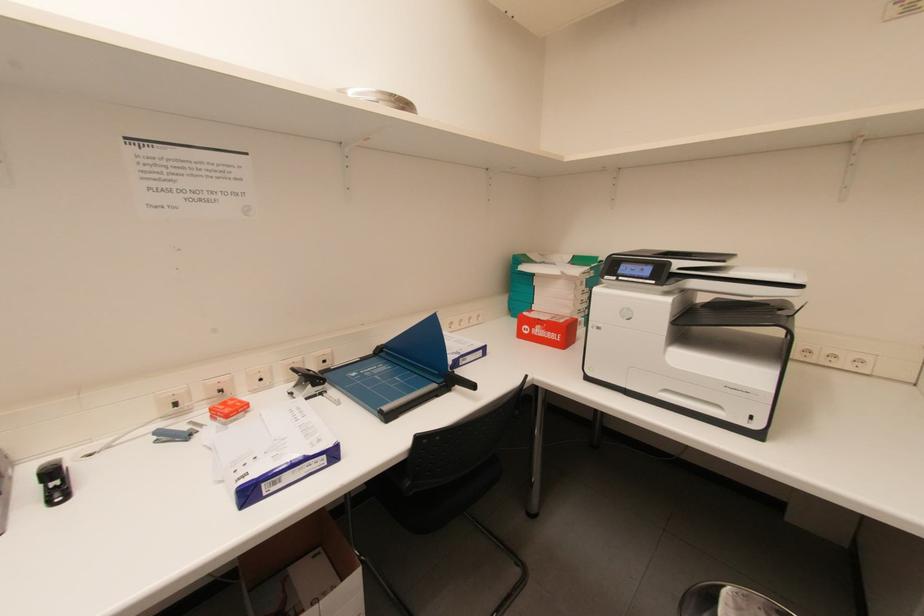
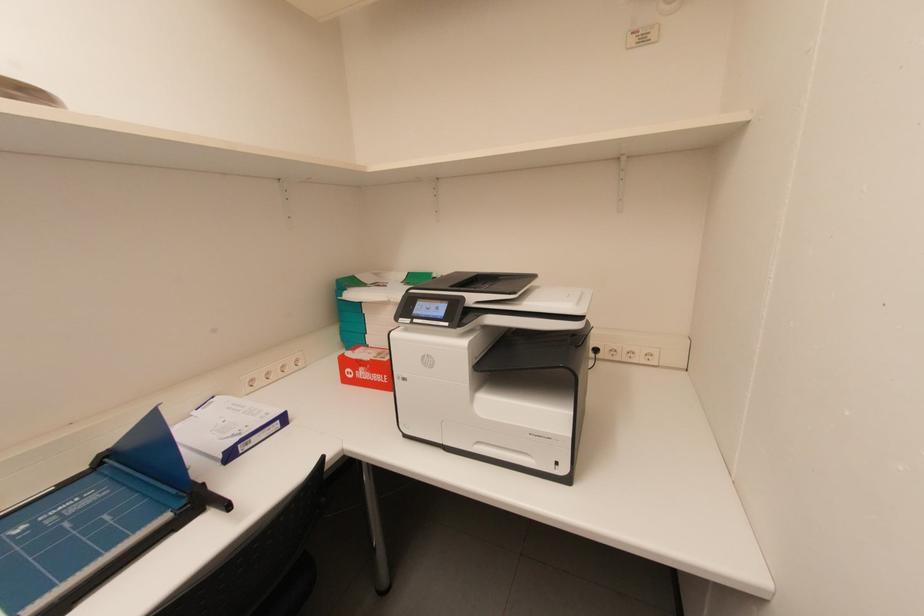
What movement of the cameraman would produce the second image?

The movement direction of the cameraman is right, forward.